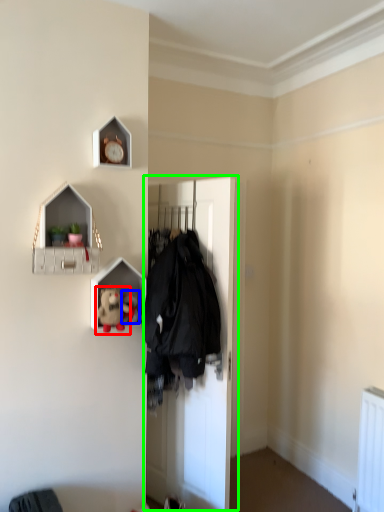
Question: Estimate the real-world distances between objects in this image. Which object is farther from toy (highlighted by a red box), toy (highlighted by a blue box) or door (highlighted by a green box)?

Choices:
 (A) toy
 (B) door

Answer: (B)